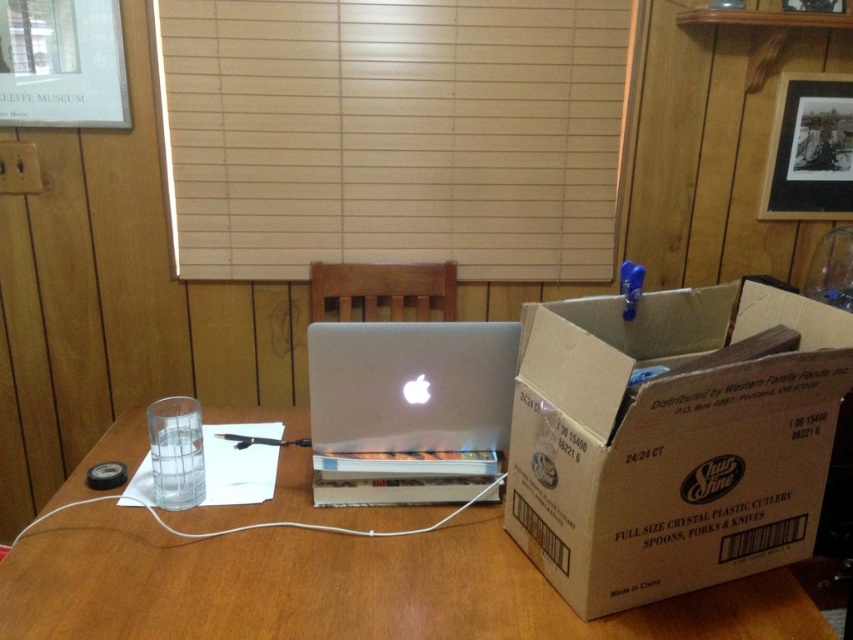
Which of these two, brown cardboard box at right or silver metallic laptop at center, stands taller?

Standing taller between the two is brown cardboard box at right.

The width and height of the screenshot is (853, 640). Describe the element at coordinates (670, 442) in the screenshot. I see `brown cardboard box at right` at that location.

You are a GUI agent. You are given a task and a screenshot of the screen. Output one action in this format:
    pyautogui.click(x=<x>, y=<y>)
    Task: Click on the brown cardboard box at right
    The width and height of the screenshot is (853, 640).
    Given the screenshot: What is the action you would take?
    pyautogui.click(x=670, y=442)

Does wooden table at center appear over silver metallic laptop at center?

Actually, wooden table at center is below silver metallic laptop at center.

What are the coordinates of `wooden table at center` in the screenshot? It's located at (340, 588).

Image resolution: width=853 pixels, height=640 pixels. Identify the location of wooden table at center. (340, 588).

Which of these two, brown cardboard box at right or wooden table at center, stands taller?

Standing taller between the two is brown cardboard box at right.

Between brown cardboard box at right and wooden table at center, which one has less height?

Standing shorter between the two is wooden table at center.

The height and width of the screenshot is (640, 853). What are the coordinates of `brown cardboard box at right` in the screenshot? It's located at (670, 442).